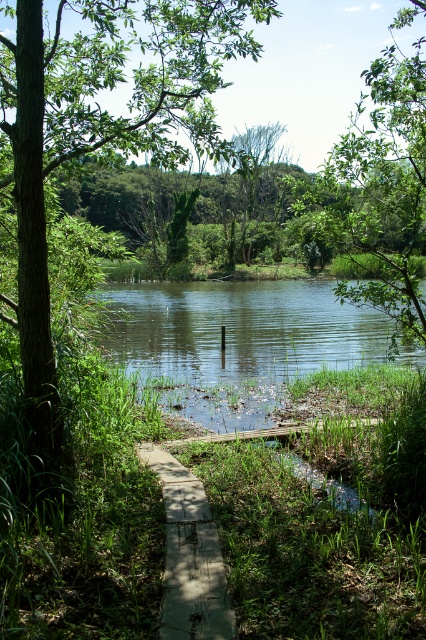
From the picture: You are standing at the wooden pathway in the scene. If you face the green leafy tree at upper center, which direction should you walk to reach it?

The green leafy tree at upper center is located at coordinates point (x=382, y=189), so you should walk forward towards it from the wooden pathway.

You are standing at the edge of the wooden pathway and want to reach the green grassy river at center. Which direction should you walk to reach it?

The green grassy river at center is located at point (236, 340) in the image, so you should walk towards the center of the image to reach it.